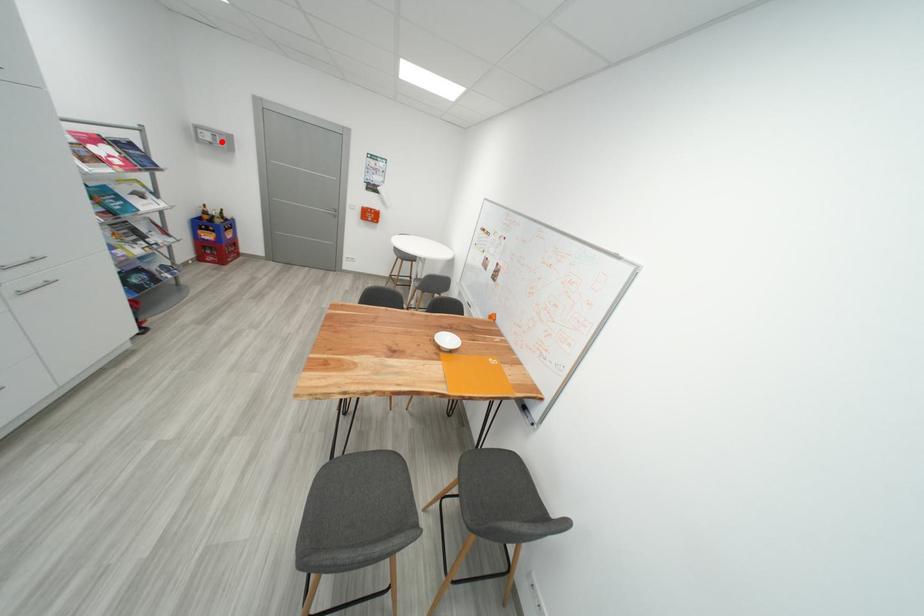
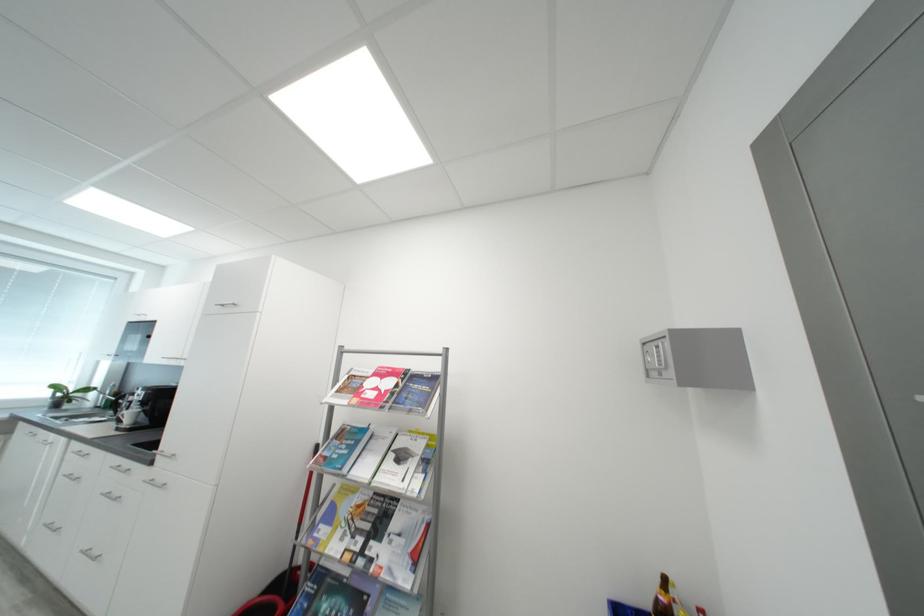
The point at the highlighted location is marked in the first image. Where is the corresponding point in the second image?

(666, 362)